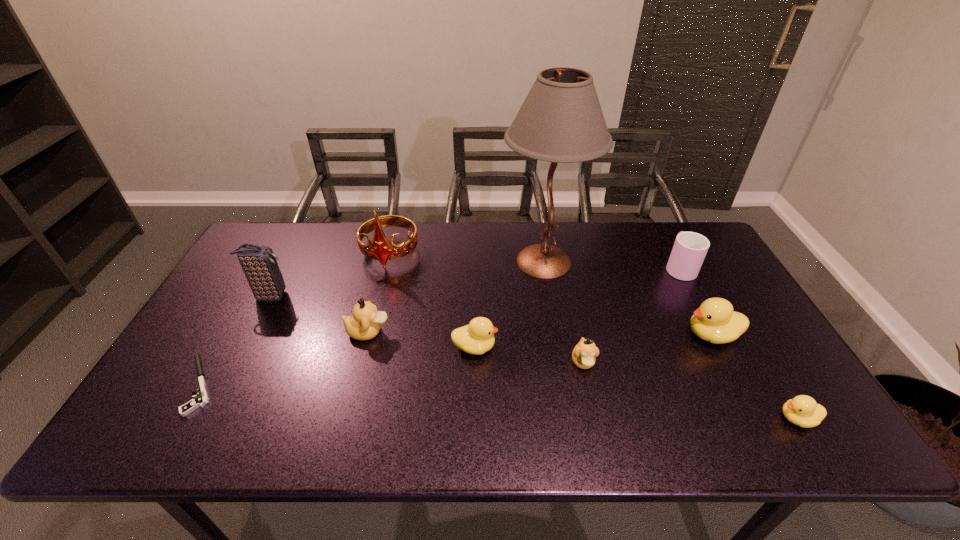
Find the location of a particular element. duckling that is the closest to the bigger tan duckling is located at coordinates (478, 337).

At what (x,y) coordinates should I click in order to perform the action: click on the second closest yellow duckling relative to the shortest duckling. Please return your answer as a coordinate pair (x, y). This screenshot has width=960, height=540. Looking at the image, I should click on (478, 337).

This screenshot has height=540, width=960. What are the coordinates of `yellow duckling object that ranks as the closest to the tallest object` in the screenshot? It's located at (478, 337).

Where is `vacant region that satisfies the following two spatial constraints: 1. with the handle on the side of the cup; 2. on the front-facing side of the table lamp`? This screenshot has width=960, height=540. vacant region that satisfies the following two spatial constraints: 1. with the handle on the side of the cup; 2. on the front-facing side of the table lamp is located at coordinates (676, 261).